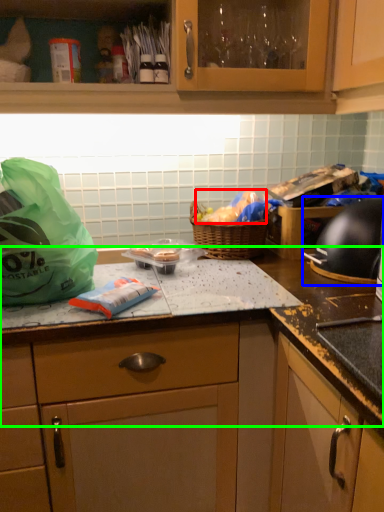
Question: Which object is the farthest from food (highlighted by a red box)? Choose among these: gas stove (highlighted by a blue box) or countertop (highlighted by a green box).

Choices:
 (A) gas stove
 (B) countertop

Answer: (B)